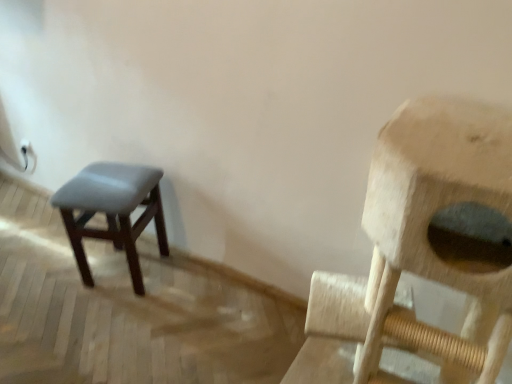
Image resolution: width=512 pixels, height=384 pixels. I want to click on vacant space that is to the left of matte gray stool at left, so click(50, 278).